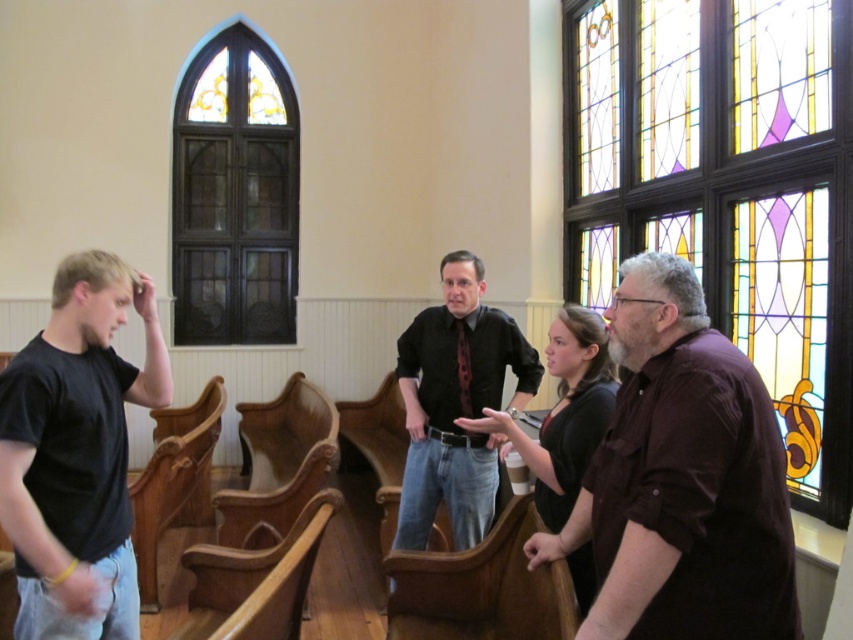
Does point (811, 1) come behind point (271, 172)?

That is False.

Can you confirm if stained glass window at right is bigger than stained glass window at upper left?

Yes.

Is point (846, 182) positioned behind point (178, 323)?

No, (846, 182) is closer to viewer.

Locate an element on the screen. The image size is (853, 640). stained glass window at right is located at coordinates (727, 188).

Between point (86, 339) and point (242, 228), which one is positioned in front?

Point (86, 339) is more forward.

You are a GUI agent. You are given a task and a screenshot of the screen. Output one action in this format:
    pyautogui.click(x=<x>, y=<y>)
    Task: Click on the black matte t-shirt at left
    
    Given the screenshot: What is the action you would take?
    pyautogui.click(x=77, y=452)

Find the location of a particular element. This screenshot has height=640, width=853. black matte t-shirt at left is located at coordinates (77, 452).

Is stained glass window at right to the right of brown satin shirt at right from the viewer's perspective?

Indeed, stained glass window at right is positioned on the right side of brown satin shirt at right.

What do you see at coordinates (727, 188) in the screenshot? This screenshot has height=640, width=853. I see `stained glass window at right` at bounding box center [727, 188].

Does point (814, 253) lie behind point (613, 321)?

Yes, point (814, 253) is behind point (613, 321).

At what (x,y) coordinates should I click in order to perform the action: click on stained glass window at right. Please return your answer as a coordinate pair (x, y). Looking at the image, I should click on (727, 188).